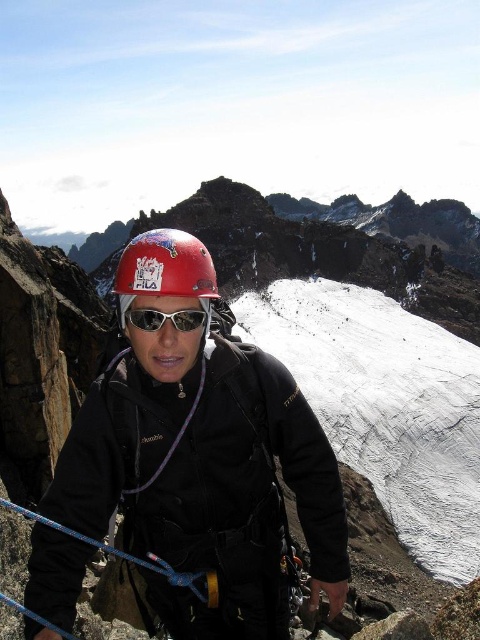
Measure the distance from blue synthetic rope at lower left to white reflective lens goggles at center.

A distance of 12.08 meters exists between blue synthetic rope at lower left and white reflective lens goggles at center.

Does blue synthetic rope at lower left appear on the left side of white reflective lens goggles at center?

Indeed, blue synthetic rope at lower left is positioned on the left side of white reflective lens goggles at center.

This screenshot has width=480, height=640. What are the coordinates of `blue synthetic rope at lower left` in the screenshot? It's located at (133, 557).

Where is `blue synthetic rope at lower left`? blue synthetic rope at lower left is located at coordinates (133, 557).

Who is more distant from viewer, (183, 360) or (144, 566)?

The point (144, 566) is more distant.

Can you confirm if matte red helmet at center is positioned below blue synthetic rope at lower left?

Actually, matte red helmet at center is above blue synthetic rope at lower left.

Find the location of a particular element. matte red helmet at center is located at coordinates [165, 300].

Is matte black helmet at center wider than white reflective lens goggles at center?

Correct, the width of matte black helmet at center exceeds that of white reflective lens goggles at center.

Between point (264, 589) and point (165, 316), which one is positioned behind?

Positioned behind is point (264, 589).

This screenshot has height=640, width=480. I want to click on matte black helmet at center, so click(202, 456).